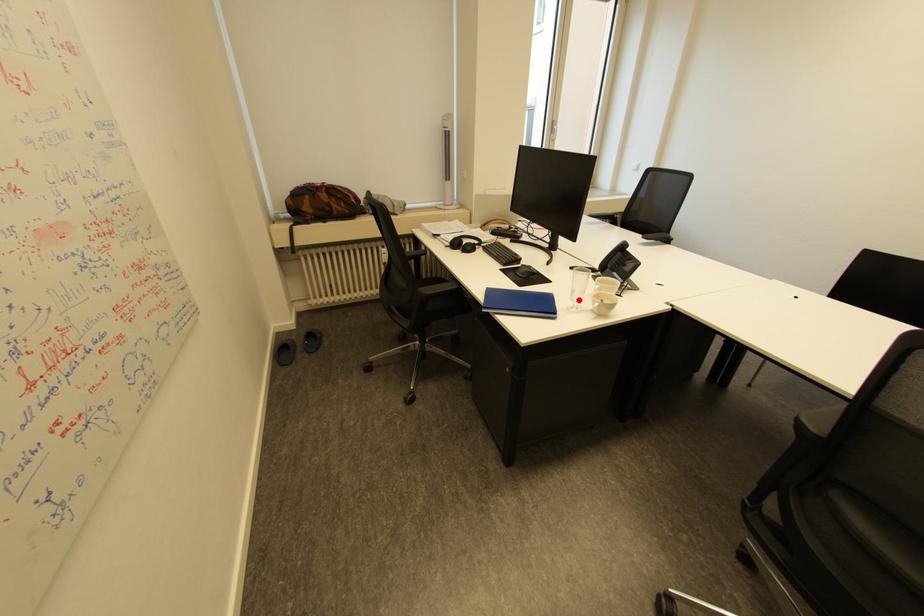
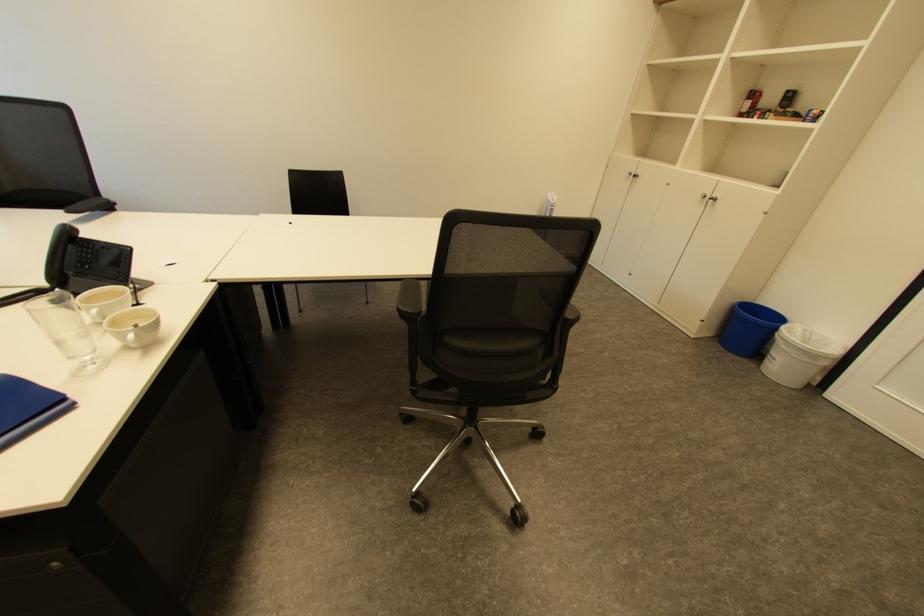
Find the pixel in the second image that matches the highlighted location in the first image.

(76, 358)